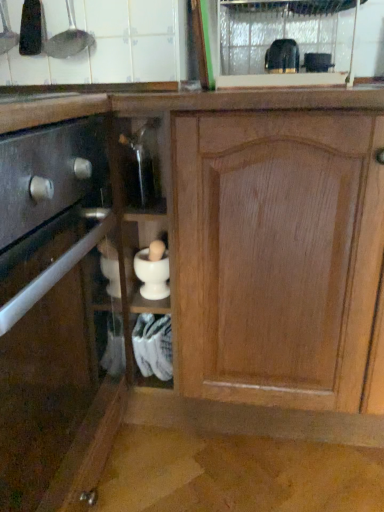
Question: Considering the positions of black plastic toaster at upper center, the 5th appliance when ordered from left to right, and matte black drawer at left, the 1th cabinetry when ordered from left to right, in the image, is black plastic toaster at upper center, the 5th appliance when ordered from left to right, taller or shorter than matte black drawer at left, the 1th cabinetry when ordered from left to right,?

Choices:
 (A) short
 (B) tall

Answer: (A)

Question: From the image's perspective, is black plastic toaster at upper center, the 5th appliance when ordered from left to right, located above or below matte black drawer at left, acting as the 2th cabinetry starting from the right?

Choices:
 (A) above
 (B) below

Answer: (A)

Question: Estimate the real-world distances between objects in this image. Which object is closer to the metallic spoon at upper left, which ranks as the 5th appliance in right-to-left order?

Choices:
 (A) transparent plastic glass door at upper center
 (B) black plastic toaster at upper center, positioned as the 2th appliance in right-to-left order
 (C) matte black drawer at left, acting as the 2th cabinetry starting from the right
 (D) white matte mortar and pestle at center, positioned as the 4th appliance in left-to-right order
 (E) wooden cabinet at center, which is the second cabinetry in left-to-right order

Answer: (B)

Question: Considering the real-world distances, which object is closest to the transparent glass bottle at center, acting as the 4th appliance starting from the right?

Choices:
 (A) wooden cabinet at center, which is the second cabinetry in left-to-right order
 (B) white matte mortar and pestle at center, which appears as the 3th appliance when viewed from the right
 (C) metallic silver ladle at upper left, placed as the 6th appliance when sorted from right to left
 (D) transparent plastic glass door at upper center
 (E) metallic spoon at upper left, which ranks as the 5th appliance in right-to-left order

Answer: (B)